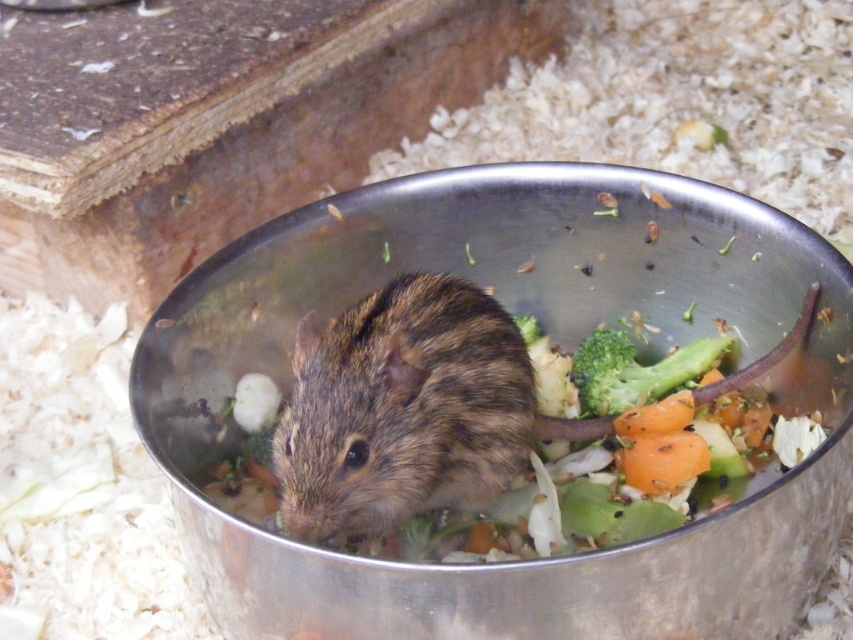
From the picture: You are a pet owner who wants to ensure your rodent has enough space to eat both vegetables. Given the green matte broccoli at center and the orange matte carrot at center in the bowl, which vegetable takes up more space?

The green matte broccoli at center is bigger than the orange matte carrot at center, so it takes up more space in the bowl.

You are a photographer trying to capture a closeup of the vegetables in the bowl. There are two points of interest marked in the image at coordinates point (x=378, y=337) and point (x=618, y=378). Which point should you focus on to ensure the vegetables are in sharp focus?

Point (x=378, y=337) is closer to the camera than point (x=618, y=378), so focusing on point (x=378, y=337) will ensure the vegetables are in sharp focus.

You are a rodent in the bowl and want to reach the green matte broccoli at center. What is the shortest path you can take from your current position at point [636,371]?

The shortest path from point [636,371] to the green matte broccoli at center would be a straight line towards the center of the bowl since there are no obstacles mentioned in the scene description.